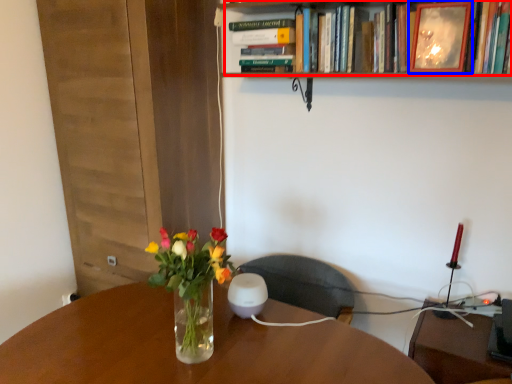
Question: Which of the following is the closest to the observer, book (highlighted by a red box) or picture frame (highlighted by a blue box)?

Choices:
 (A) book
 (B) picture frame

Answer: (A)